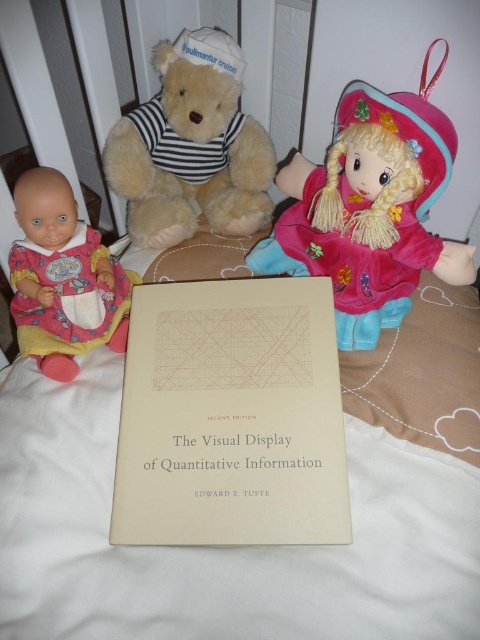
You are organizing a toy drive and need to stack the fluffy beige teddy bear at upper center and the matte pink fabric baby doll at left into a box. Which toy should you place at the bottom of the box to ensure stability?

The fluffy beige teddy bear at upper center should be placed at the bottom of the box because it is above the matte pink fabric baby doll at left in the original arrangement, indicating it might be larger or heavier, providing better stability.

You are a toy organizer who needs to place a new toy between the beige paper book at center and the fluffy beige teddy bear at upper center. The new toy is 25 centimeters long. Can the toy fit in the space between them?

The distance between the beige paper book at center and the fluffy beige teddy bear at upper center is 30.01 centimeters. Since the new toy is 25 centimeters long, it can fit in the space between them.

You are a toy organizer trying to place the fluffy beige teddy bear at upper center and the matte pink fabric baby doll at left into a storage box. The box can only fit items that are narrower than 30 cm. Based on their widths, can both toys fit into the box?

The fluffy beige teddy bear at upper center might be wider than matte pink fabric baby doll at left. Since the box can only fit items narrower than 30 cm, we need to check both widths. If the teddy bear is wider than 30 cm, it won